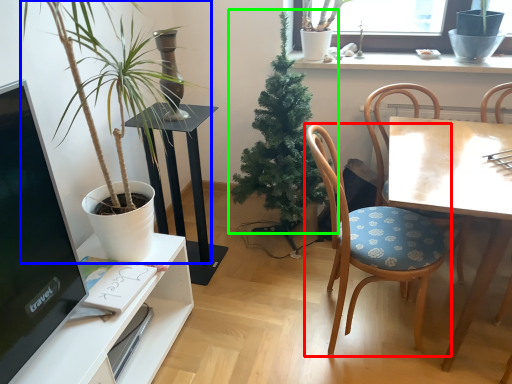
Question: Which object is positioned closest to chair (highlighted by a red box)? Select from houseplant (highlighted by a blue box) and houseplant (highlighted by a green box).

Choices:
 (A) houseplant
 (B) houseplant

Answer: (B)